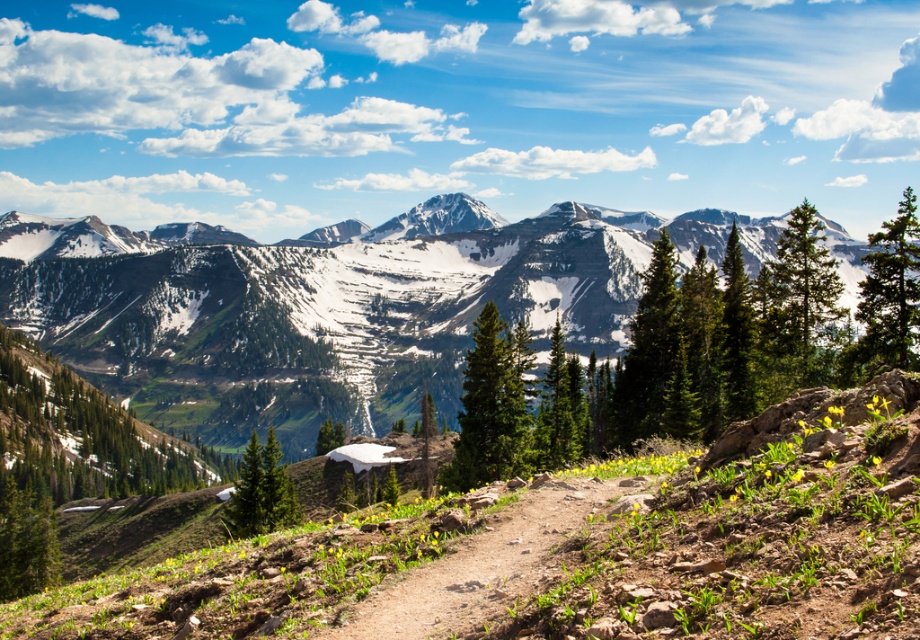
Question: Which point is farther to the camera?

Choices:
 (A) brown dirt path at center
 (B) snowy granite mountains at center

Answer: (B)

Question: Observing the image, what is the correct spatial positioning of snowy granite mountains at center in reference to brown dirt path at center?

Choices:
 (A) right
 (B) left

Answer: (B)

Question: Which point is farther to the camera?

Choices:
 (A) brown dirt path at center
 (B) snowy granite mountains at center

Answer: (B)

Question: Where is snowy granite mountains at center located in relation to brown dirt path at center in the image?

Choices:
 (A) above
 (B) below

Answer: (A)

Question: Is snowy granite mountains at center closer to camera compared to brown dirt path at center?

Choices:
 (A) yes
 (B) no

Answer: (B)